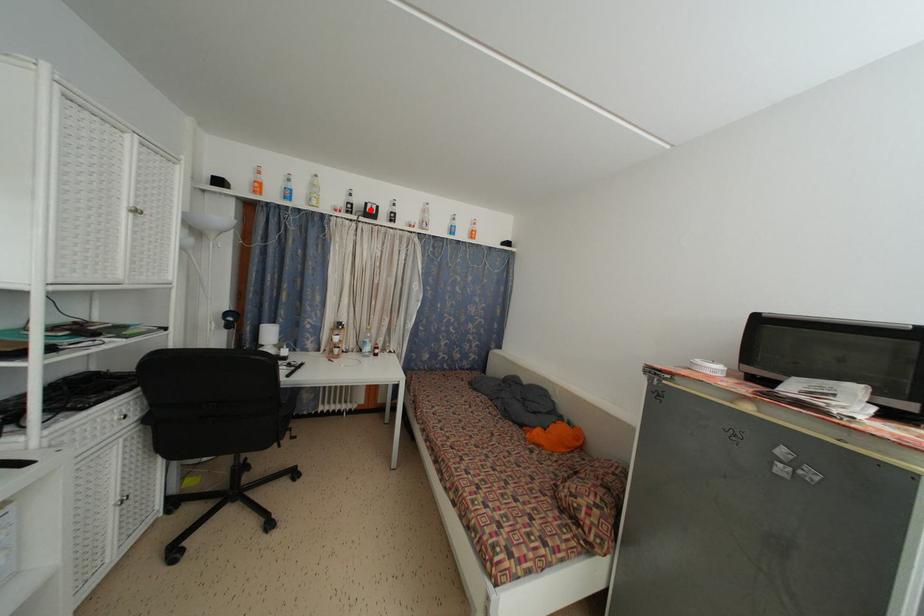
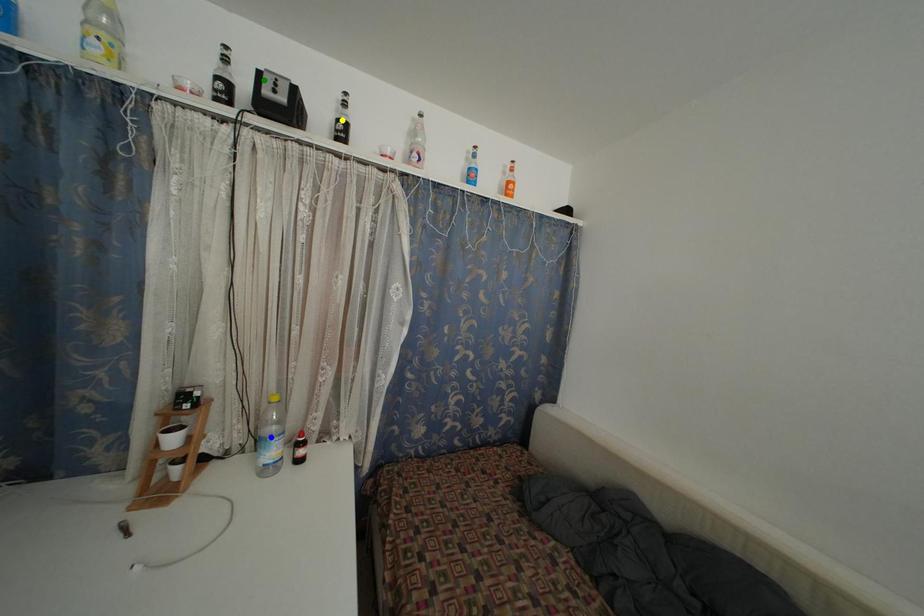
Question: I am providing you with two images of the same scene from different viewpoints. A red point is marked on the first image. You are given multiple points on the second image. Which point in image 2 is actually the same real-world point as the red point in image 1?

Choices:
 (A) yellow point
 (B) blue point
 (C) green point

Answer: (C)